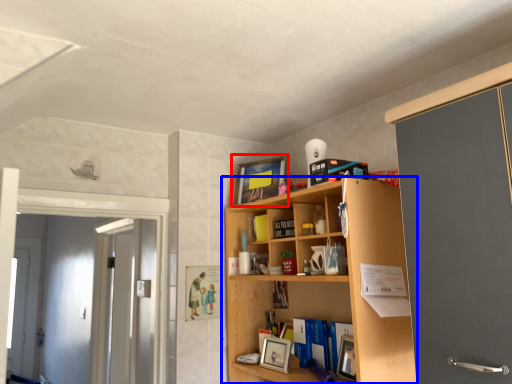
Question: Which of the following is the closest to the observer, picture frame (highlighted by a red box) or shelf (highlighted by a blue box)?

Choices:
 (A) picture frame
 (B) shelf

Answer: (B)